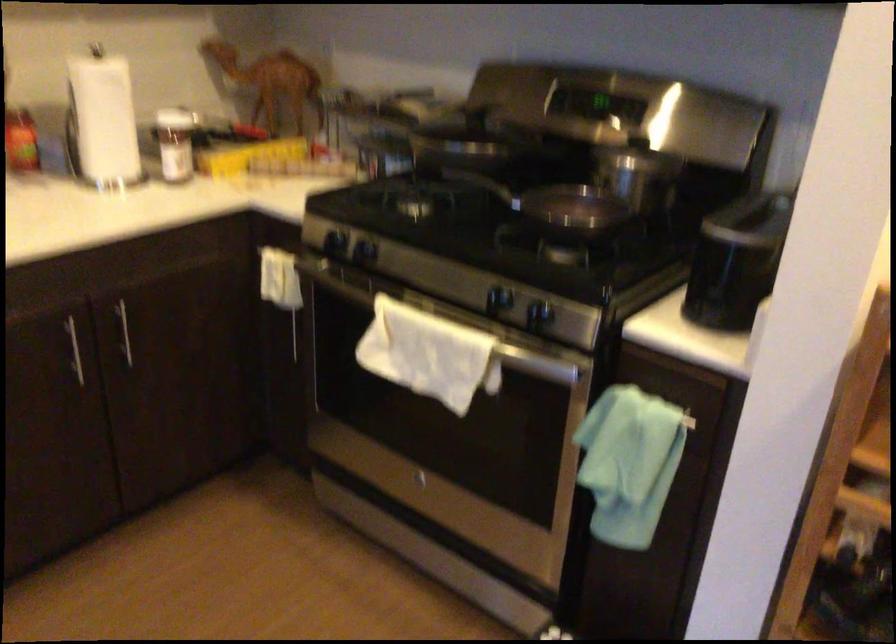
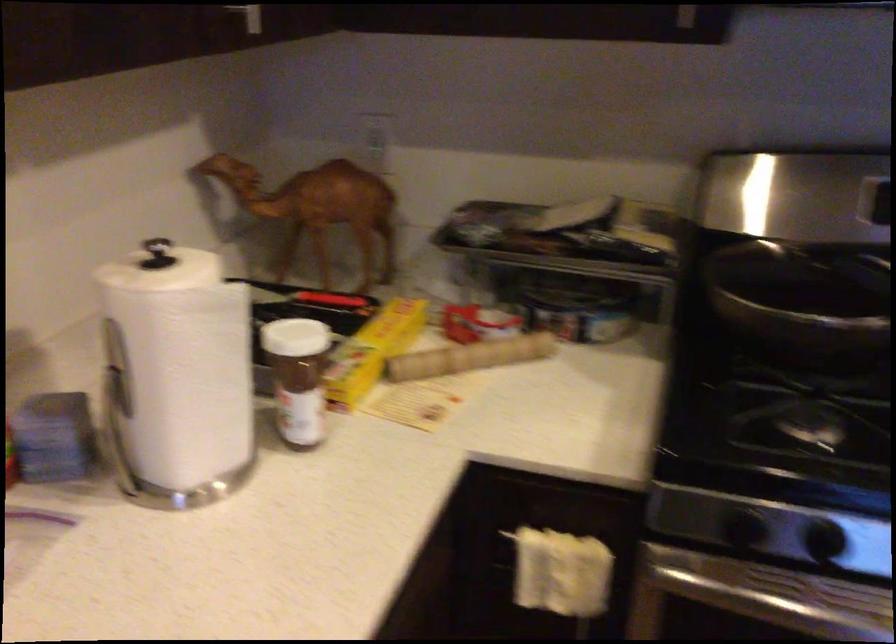
Find the pixel in the second image that matches [293,163] in the first image.

(469, 357)